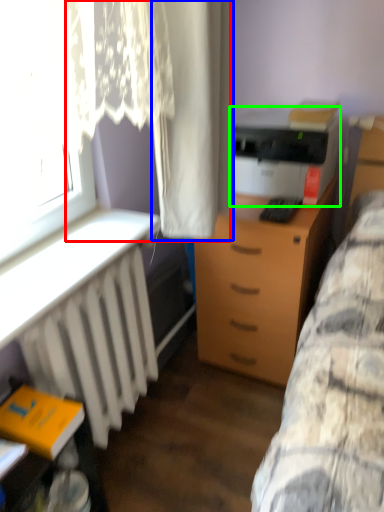
Question: Considering the real-world distances, which object is closest to curtain (highlighted by a red box)? curtain (highlighted by a blue box) or printer (highlighted by a green box).

Choices:
 (A) curtain
 (B) printer

Answer: (A)